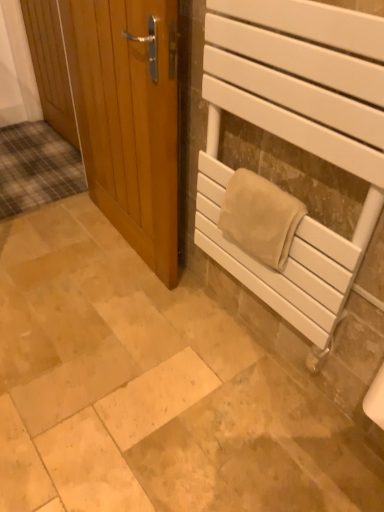
Question: Looking at their shapes, would you say light brown wooden door at left, the 1th door in the front-to-back sequence, is wider or thinner than wooden door at left, which is counted as the 1th door, starting from the left?

Choices:
 (A) thin
 (B) wide

Answer: (B)

Question: From a real-world perspective, relative to wooden door at left, marked as the second door in a front-to-back arrangement, is light brown wooden door at left, placed as the first door when sorted from right to left, vertically above or below?

Choices:
 (A) above
 (B) below

Answer: (A)

Question: Which of these objects is positioned farthest from the wooden door at left, marked as the second door in a front-to-back arrangement?

Choices:
 (A) white matte towel rack at right
 (B) light brown wooden door at left, the 1th door in the front-to-back sequence
 (C) beige soft towel at right

Answer: (C)

Question: Which object is the closest to the white matte towel rack at right?

Choices:
 (A) wooden door at left, the second door when ordered from right to left
 (B) light brown wooden door at left, placed as the first door when sorted from right to left
 (C) beige soft towel at right

Answer: (C)